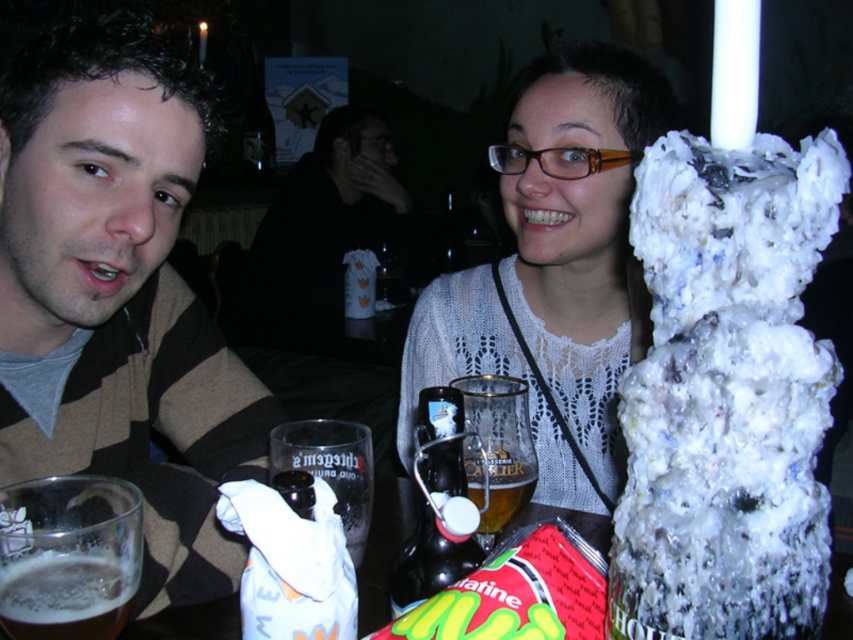
You are a photographer trying to capture a closeup of the striped sweater at left and the foamy white beer at lower left. Which object should you zoom in on first if you want to focus on the wider one?

The striped sweater at left is wider than the foamy white beer at lower left, so you should focus on the striped sweater at left first.

Based on the scene description, which object is positioned higher up between the striped sweater at left and the white knitted sweater at upper center?

The white knitted sweater at upper center is positioned higher up than the striped sweater at left.

You are a photographer trying to capture a closeup of the two people at the table. There are two points on the table that you need to avoid blocking with your camera. The first point is at point (25, 262) and the second is at point (708, 273). Which point should you prioritize keeping in the frame to ensure it is closer to the camera?

Point (25, 262) is closer to the camera than point (708, 273), so you should prioritize keeping point (25, 262) in the frame to ensure it is closer to the camera.